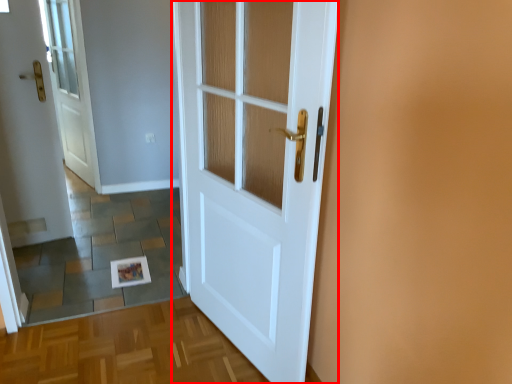
Question: From the image's perspective, what is the correct spatial positioning of door (annotated by the red box) in reference to door?

Choices:
 (A) above
 (B) below

Answer: (B)